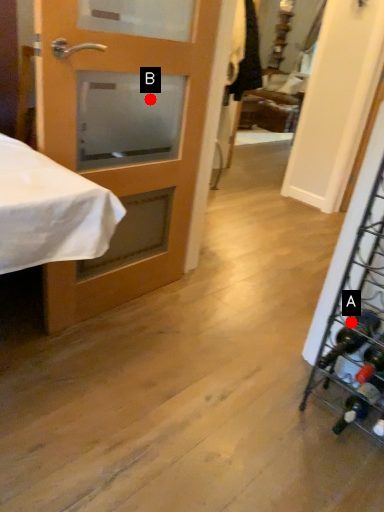
Question: Two points are circled on the image, labeled by A and B beside each circle. Which of the following is the farthest from the observer?

Choices:
 (A) A is further
 (B) B is further

Answer: (B)